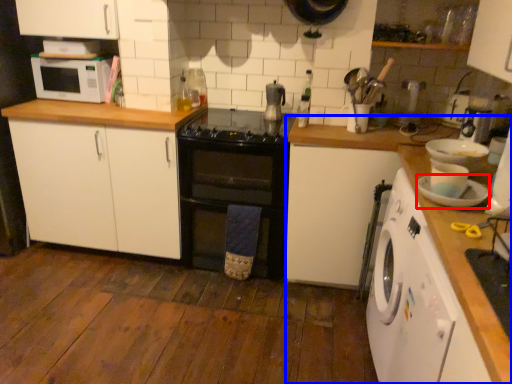
Question: Which object is further to the camera taking this photo, appliance (highlighted by a red box) or countertop (highlighted by a blue box)?

Choices:
 (A) appliance
 (B) countertop

Answer: (B)